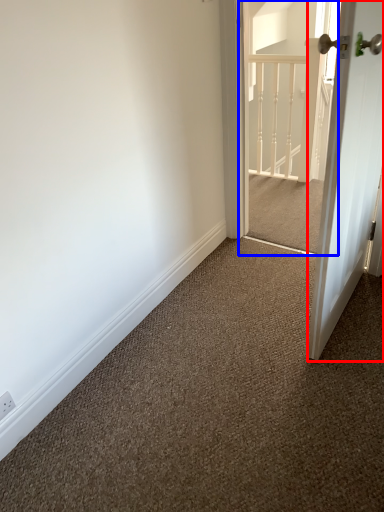
Question: Which object is closer to the camera taking this photo, door (highlighted by a red box) or screen door (highlighted by a blue box)?

Choices:
 (A) door
 (B) screen door

Answer: (A)